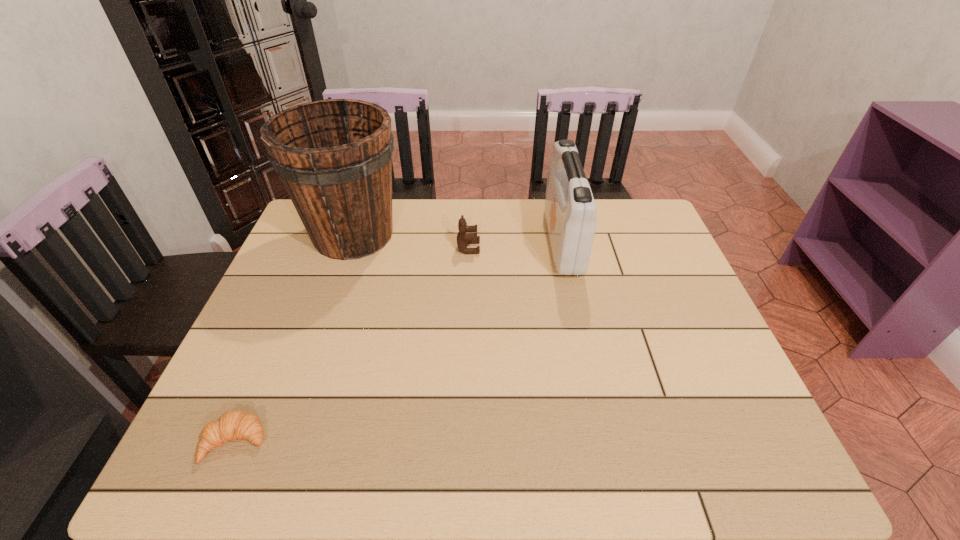
Find the location of a particular element. This screenshot has width=960, height=540. free region located 0.100m on the front side of the third shortest object is located at coordinates (516, 242).

This screenshot has width=960, height=540. I want to click on vacant space located on the face of the teddy bear, so click(547, 248).

Identify the location of vacant space located 0.380m on the back of the crescent roll. This screenshot has height=540, width=960. (300, 289).

You are a GUI agent. You are given a task and a screenshot of the screen. Output one action in this format:
    pyautogui.click(x=<x>, y=<y>)
    Task: Click on the bucket present at the far edge
    Image resolution: width=960 pixels, height=540 pixels.
    Given the screenshot: What is the action you would take?
    pyautogui.click(x=334, y=157)

You are a GUI agent. You are given a task and a screenshot of the screen. Output one action in this format:
    pyautogui.click(x=<x>, y=<y>)
    Task: Click on the first-aid kit that is at the far edge
    The width and height of the screenshot is (960, 540).
    Given the screenshot: What is the action you would take?
    pyautogui.click(x=570, y=211)

Locate an element on the screen. The height and width of the screenshot is (540, 960). teddy bear that is at the far edge is located at coordinates (463, 239).

You are a GUI agent. You are given a task and a screenshot of the screen. Output one action in this format:
    pyautogui.click(x=<x>, y=<y>)
    Task: Click on the object that is at the near edge
    
    Given the screenshot: What is the action you would take?
    pyautogui.click(x=232, y=425)

Identify the location of bucket that is at the left edge. (334, 157).

At what (x,y) coordinates should I click in order to perform the action: click on crescent roll that is at the left edge. Please return your answer as a coordinate pair (x, y). The width and height of the screenshot is (960, 540). Looking at the image, I should click on (232, 425).

What are the coordinates of `object present at the far left corner` in the screenshot? It's located at (334, 157).